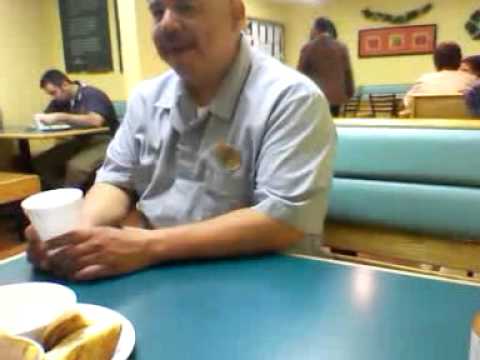
Locate an element on the screen. This screenshot has height=360, width=480. black picture on wall is located at coordinates (82, 9), (93, 53).